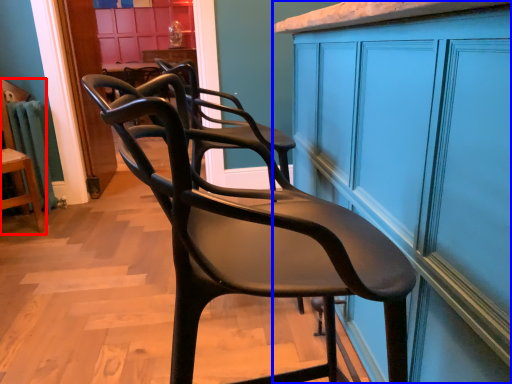
Question: Among these objects, which one is nearest to the camera, chair (highlighted by a red box) or cabinetry (highlighted by a blue box)?

Choices:
 (A) chair
 (B) cabinetry

Answer: (B)